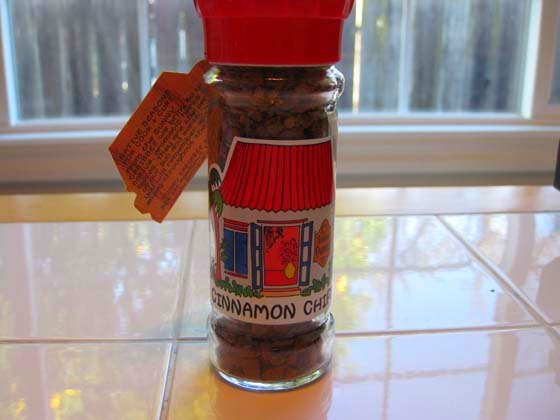
Identify the location of window. The image size is (560, 420). (370, 64).